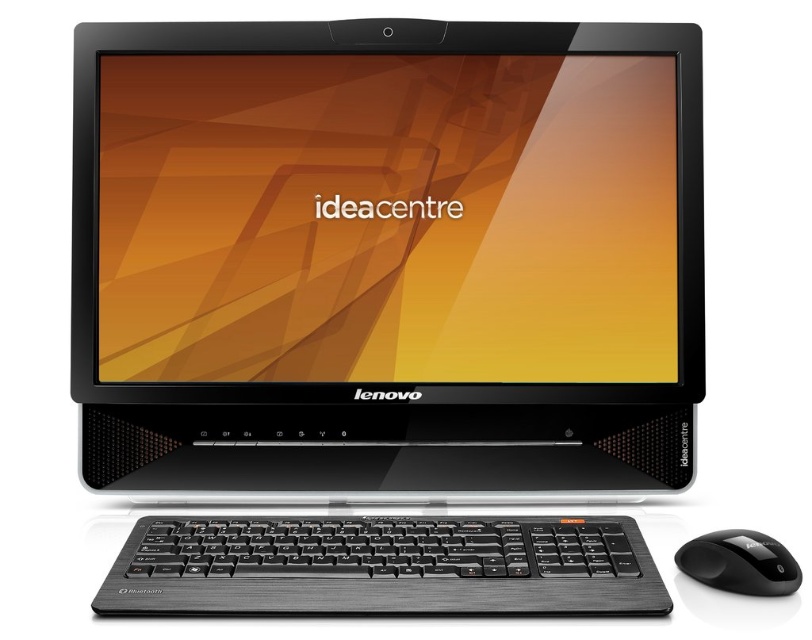
You are setting up a new Lenovo IdeaCentre desktop computer. You have a black matte laptop at center that you want to place on the desk. The desk is 30 inches wide. Can the laptop fit on the desk if it is placed in the center?

The black matte laptop at center is 28.39 inches away from camera. Since the desk is 30 inches wide, the laptop can fit on the desk when placed in the center as its width is less than the desk width.

You are setting up a workspace and need to place both the black matte laptop at center and the black brushed metal keyboard at lower center. Based on the image, which object is located higher on the desk?

The black matte laptop at center is positioned over the black brushed metal keyboard at lower center, so it is higher on the desk.

You are setting up a new Lenovo IdeaCentre desktop computer. You want to place the black brushed metal keyboard at lower center and the black plastic mouse at lower right in a way that they are exactly 6 inches apart. Based on the current setup, will you need to move them closer or farther apart to achieve this?

The black brushed metal keyboard at lower center is currently 6.44 inches away from the black plastic mouse at lower right. To reach the desired 6 inches, you need to move them closer by 0.44 inches.